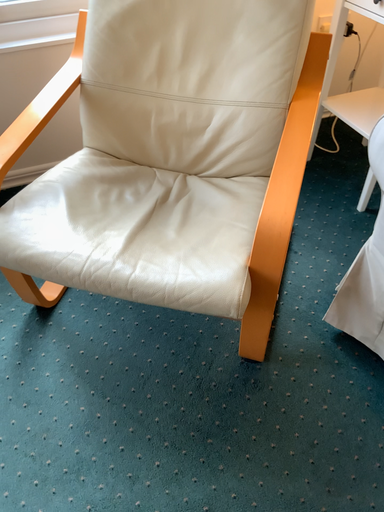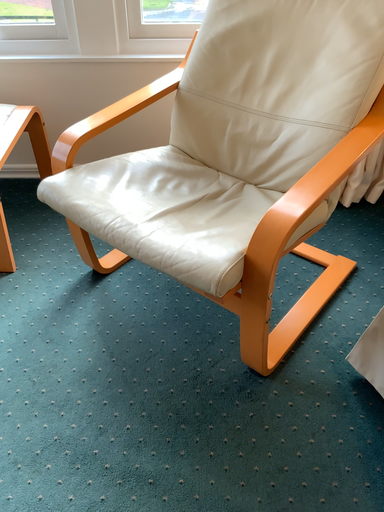
Question: How did the camera likely rotate when shooting the video?

Choices:
 (A) rotated upward
 (B) rotated downward

Answer: (A)